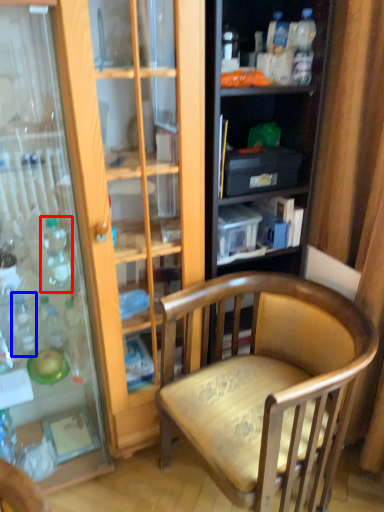
Question: Which object appears farthest to the camera in this image, bottle (highlighted by a red box) or bottle (highlighted by a blue box)?

Choices:
 (A) bottle
 (B) bottle

Answer: (B)